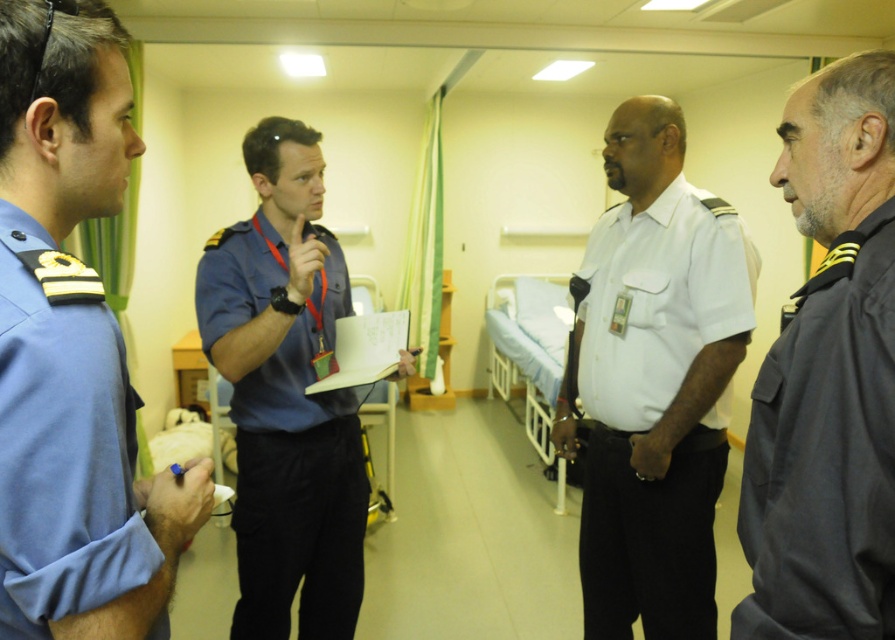
Can you confirm if white cotton shirt at center is positioned to the right of blue uniform at center?

Yes, white cotton shirt at center is to the right of blue uniform at center.

Between white cotton shirt at center and blue uniform at center, which one has more height?

white cotton shirt at center

Does point (592, 452) come closer to viewer compared to point (310, 490)?

No, it is behind (310, 490).

At what (x,y) coordinates should I click in order to perform the action: click on white cotton shirt at center. Please return your answer as a coordinate pair (x, y). The image size is (895, 640). Looking at the image, I should click on (655, 406).

Between dark gray cotton shirt at right and blue uniform at center, which one has less height?

dark gray cotton shirt at right is shorter.

Does point (840, 454) lie in front of point (280, 436)?

Yes, point (840, 454) is closer to viewer.

This screenshot has width=895, height=640. In order to click on dark gray cotton shirt at right in this screenshot , I will do `click(825, 454)`.

Does blue uniform at left appear over blue uniform at center?

Yes.

Can you confirm if blue uniform at left is positioned below blue uniform at center?

No, blue uniform at left is not below blue uniform at center.

Between point (75, 262) and point (301, 496), which one is positioned behind?

The point (301, 496) is behind.

Locate an element on the screen. The height and width of the screenshot is (640, 895). blue uniform at left is located at coordinates (77, 480).